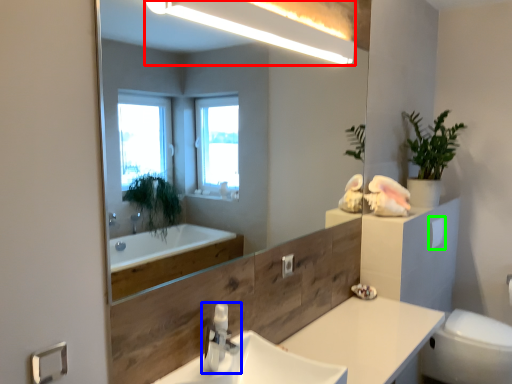
Question: Which is farther away from light fixture (highlighted by a red box)? tap (highlighted by a blue box) or toilet paper (highlighted by a green box)?

Choices:
 (A) tap
 (B) toilet paper

Answer: (B)